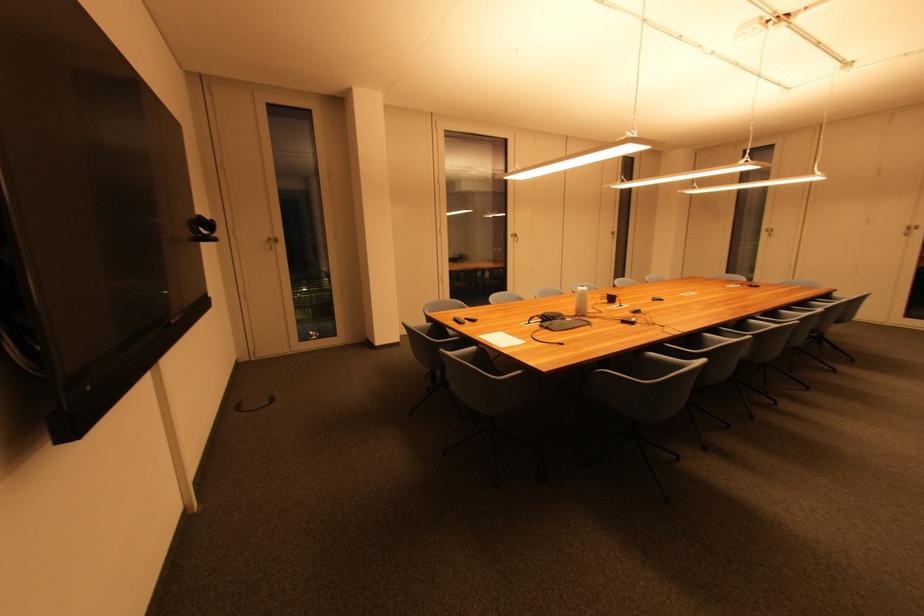
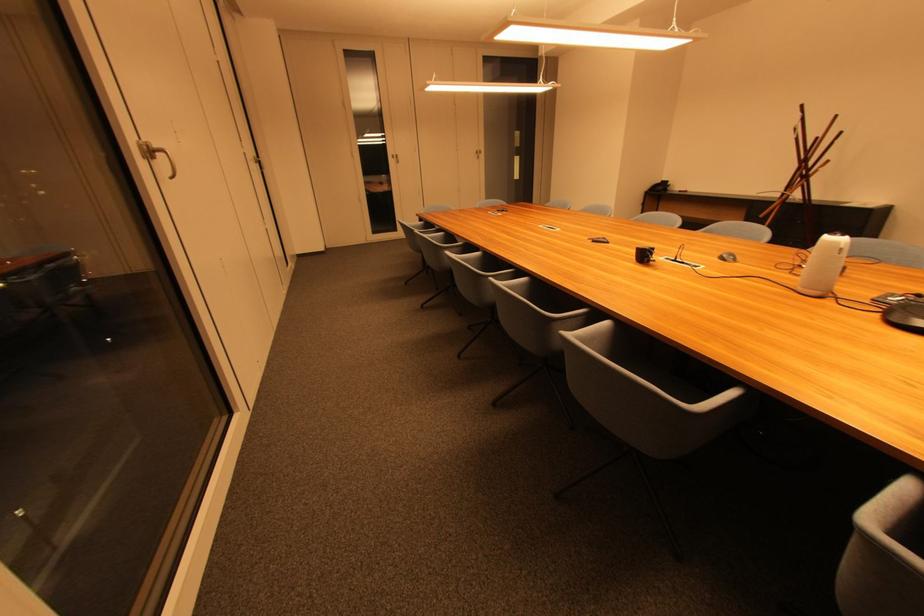
The point at [616,235] is marked in the first image. Where is the corresponding point in the second image?

(259, 163)